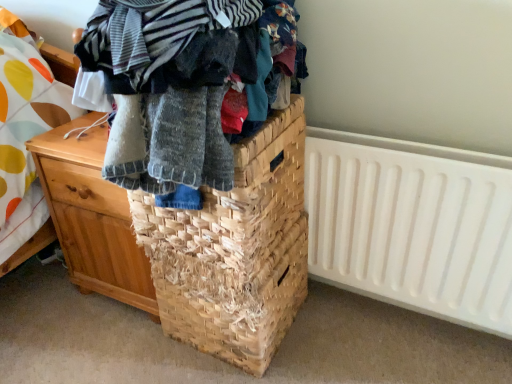
This screenshot has width=512, height=384. Find the location of `space that is in front of wooden chest of drawers at left`. space that is in front of wooden chest of drawers at left is located at coordinates (106, 350).